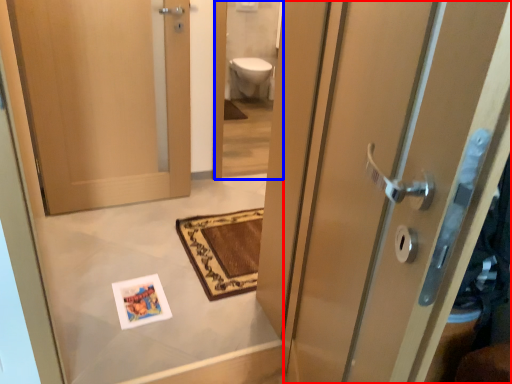
Question: Among these objects, which one is nearest to the camera, door (highlighted by a red box) or mirror (highlighted by a blue box)?

Choices:
 (A) door
 (B) mirror

Answer: (A)